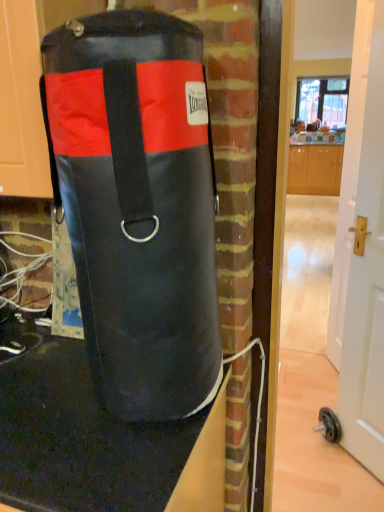
Image resolution: width=384 pixels, height=512 pixels. I want to click on black leather punching bag at center, so click(x=138, y=204).

At what (x,y) coordinates should I click in order to perform the action: click on black rubber mat at lower left. Please return your answer as a coordinate pair (x, y). The height and width of the screenshot is (512, 384). Looking at the image, I should click on (96, 439).

This screenshot has height=512, width=384. In order to click on black leather punching bag at center in this screenshot , I will do `click(138, 204)`.

From the image's perspective, is white glossy door at center right positioned above or below transparent glass window at upper center?

white glossy door at center right is situated lower than transparent glass window at upper center in the image.

Would you say white glossy door at center right is a long distance from transparent glass window at upper center?

Yes, white glossy door at center right and transparent glass window at upper center are quite far apart.

Which is in front, white glossy door at center right or transparent glass window at upper center?

white glossy door at center right is more forward.

Is white glossy door at center right taller or shorter than transparent glass window at upper center?

In the image, white glossy door at center right appears to be taller than transparent glass window at upper center.

Is black leather punching bag at center oriented towards transparent glass window at upper center?

No, black leather punching bag at center does not turn towards transparent glass window at upper center.

Who is bigger, black leather punching bag at center or transparent glass window at upper center?

transparent glass window at upper center is bigger.

What's the angular difference between black leather punching bag at center and transparent glass window at upper center's facing directions?

The facing directions of black leather punching bag at center and transparent glass window at upper center are 0.0168 degrees apart.

Between black leather punching bag at center and transparent glass window at upper center, which one has more height?

transparent glass window at upper center.

Is white glossy door at center right in contact with black rubber mat at lower left?

No, white glossy door at center right is not next to black rubber mat at lower left.

From the picture: Does white glossy door at center right appear on the right side of black rubber mat at lower left?

Correct, you'll find white glossy door at center right to the right of black rubber mat at lower left.

Where is `table top located below the white glossy door at center right (from the image's perspective)`? Image resolution: width=384 pixels, height=512 pixels. table top located below the white glossy door at center right (from the image's perspective) is located at coordinates (96, 439).

Is white glossy door at center right wider or thinner than black rubber mat at lower left?

Considering their sizes, white glossy door at center right looks slimmer than black rubber mat at lower left.

I want to click on punching bag above the white glossy door at center right (from a real-world perspective), so click(138, 204).

From the image's perspective, is white glossy door at center right located above black leather punching bag at center?

No, from the image's perspective, white glossy door at center right is not over black leather punching bag at center.

Does point (359, 148) come behind point (91, 333)?

Yes, it is.

How distant is white glossy door at center right from black leather punching bag at center?

The distance of white glossy door at center right from black leather punching bag at center is 1.14 meters.

From the picture: Is black rubber mat at lower left not within black leather punching bag at center?

Indeed, black rubber mat at lower left is completely outside black leather punching bag at center.

I want to click on punching bag that appears in front of the black rubber mat at lower left, so click(x=138, y=204).

Is black rubber mat at lower left bigger than black leather punching bag at center?

Yes, black rubber mat at lower left is bigger than black leather punching bag at center.

Based on the photo, is black rubber mat at lower left taller than black leather punching bag at center?

Correct, black rubber mat at lower left is much taller as black leather punching bag at center.

Is transparent glass window at upper center oriented away from black leather punching bag at center?

No, transparent glass window at upper center's orientation is not away from black leather punching bag at center.

Is transparent glass window at upper center positioned behind black leather punching bag at center?

Yes.

Is transparent glass window at upper center positioned far away from black leather punching bag at center?

Yes.

Which of these two, transparent glass window at upper center or black leather punching bag at center, is bigger?

transparent glass window at upper center.

Is black leather punching bag at center placed right next to black rubber mat at lower left?

black leather punching bag at center and black rubber mat at lower left are not in contact.

Is black leather punching bag at center at the right side of black rubber mat at lower left?

Yes, black leather punching bag at center is to the right of black rubber mat at lower left.

Considering the sizes of black leather punching bag at center and black rubber mat at lower left in the image, is black leather punching bag at center bigger or smaller than black rubber mat at lower left?

Clearly, black leather punching bag at center is smaller in size than black rubber mat at lower left.

What's the angular difference between black leather punching bag at center and black rubber mat at lower left's facing directions?

The angle between the facing direction of black leather punching bag at center and the facing direction of black rubber mat at lower left is 2.35 degrees.

In the image, there is a transparent glass window at upper center. Where is `door below it (from a real-world perspective)`? The image size is (384, 512). door below it (from a real-world perspective) is located at coordinates (361, 251).

This screenshot has height=512, width=384. What are the coordinates of `window screen behind the black leather punching bag at center` in the screenshot? It's located at (322, 100).

Estimate the real-world distances between objects in this image. Which object is closer to black leather punching bag at center, transparent glass window at upper center or white glossy door at center right?

Based on the image, white glossy door at center right appears to be nearer to black leather punching bag at center.

Based on their spatial positions, is black rubber mat at lower left or transparent glass window at upper center closer to white glossy door at center right?

The object closer to white glossy door at center right is black rubber mat at lower left.

When comparing their distances from transparent glass window at upper center, does black rubber mat at lower left or black leather punching bag at center seem further?

black rubber mat at lower left.

Considering their positions, is transparent glass window at upper center positioned closer to black rubber mat at lower left than black leather punching bag at center?

Based on the image, black leather punching bag at center appears to be nearer to black rubber mat at lower left.

Which object lies nearer to the anchor point transparent glass window at upper center, black leather punching bag at center or black rubber mat at lower left?

black leather punching bag at center is positioned closer to the anchor transparent glass window at upper center.

Based on their spatial positions, is white glossy door at center right or black leather punching bag at center closer to black rubber mat at lower left?

black leather punching bag at center is positioned closer to the anchor black rubber mat at lower left.

Based on the photo, based on their spatial positions, is transparent glass window at upper center or white glossy door at center right closer to black rubber mat at lower left?

The object closer to black rubber mat at lower left is white glossy door at center right.

From the image, which object appears to be nearer to black leather punching bag at center, black rubber mat at lower left or transparent glass window at upper center?

black rubber mat at lower left.

You are a GUI agent. You are given a task and a screenshot of the screen. Output one action in this format:
    pyautogui.click(x=<x>, y=<y>)
    Task: Click on the punching bag between black rubber mat at lower left and white glossy door at center right in the horizontal direction
    This screenshot has height=512, width=384.
    Given the screenshot: What is the action you would take?
    pyautogui.click(x=138, y=204)

Find the location of a particular element. door between black leather punching bag at center and transparent glass window at upper center along the z-axis is located at coordinates (361, 251).

The height and width of the screenshot is (512, 384). Find the location of `table top positioned between black leather punching bag at center and transparent glass window at upper center from near to far`. table top positioned between black leather punching bag at center and transparent glass window at upper center from near to far is located at coordinates (96, 439).

Locate an element on the screen. The width and height of the screenshot is (384, 512). door located between black rubber mat at lower left and transparent glass window at upper center in the depth direction is located at coordinates (361, 251).